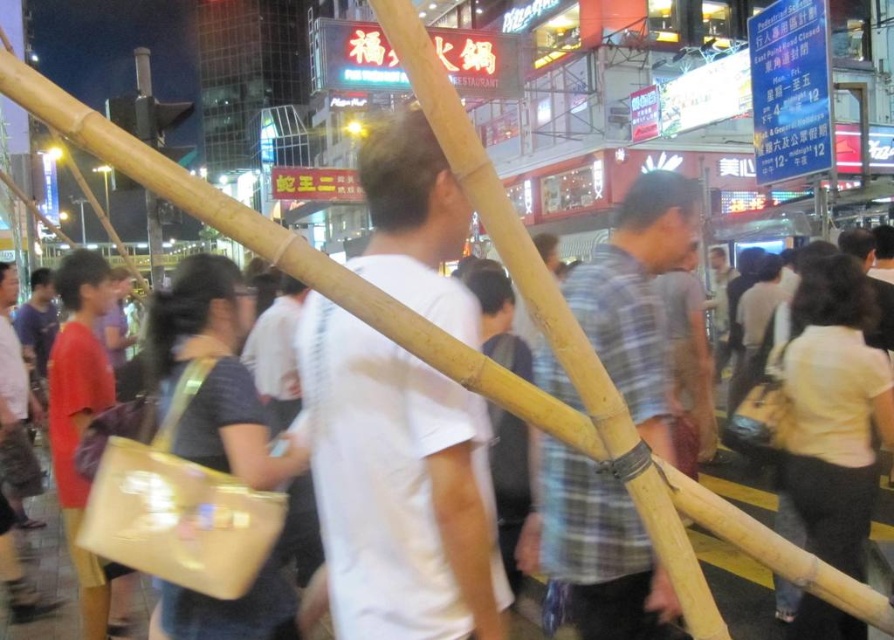
Who is shorter, white matte shirt at center or plaid fabric shirt at center?

plaid fabric shirt at center is shorter.

Can you confirm if white matte shirt at center is positioned to the right of plaid fabric shirt at center?

Incorrect, white matte shirt at center is not on the right side of plaid fabric shirt at center.

Does point (422, 545) lie in front of point (689, 192)?

Yes.

At what (x,y) coordinates should I click in order to perform the action: click on white matte shirt at center. Please return your answer as a coordinate pair (x, y). Looking at the image, I should click on (398, 486).

Is point (384, 413) less distant than point (650, 422)?

Yes, it is.

Is white matte shirt at center below natural bamboo pole at center?

No.

Does point (336, 333) come in front of point (599, 401)?

No, it is behind (599, 401).

Where is `white matte shirt at center`? white matte shirt at center is located at coordinates (398, 486).

Can you confirm if plaid fabric shirt at center is taller than natural bamboo pole at center?

Yes.

Between plaid fabric shirt at center and natural bamboo pole at center, which one appears on the right side from the viewer's perspective?

Positioned to the right is plaid fabric shirt at center.

This screenshot has width=894, height=640. Describe the element at coordinates (595, 548) in the screenshot. I see `plaid fabric shirt at center` at that location.

Image resolution: width=894 pixels, height=640 pixels. I want to click on plaid fabric shirt at center, so click(x=595, y=548).